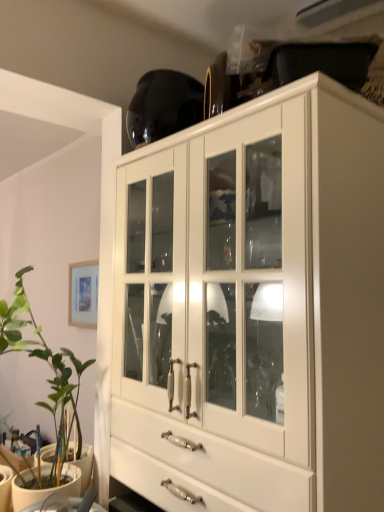
Question: Choose the correct answer: Is green leafy plant at left inside white glossy cabinet at upper center or outside it?

Choices:
 (A) outside
 (B) inside

Answer: (A)

Question: Looking at the image, does green leafy plant at left seem bigger or smaller compared to white glossy cabinet at upper center?

Choices:
 (A) small
 (B) big

Answer: (A)

Question: From the image's perspective, is green leafy plant at left above or below white glossy cabinet at upper center?

Choices:
 (A) below
 (B) above

Answer: (A)

Question: From a real-world perspective, is white glossy cabinet at upper center positioned above or below green leafy plant at left?

Choices:
 (A) below
 (B) above

Answer: (B)

Question: From the image's perspective, relative to green leafy plant at left, is white glossy cabinet at upper center above or below?

Choices:
 (A) above
 (B) below

Answer: (A)

Question: Is white glossy cabinet at upper center taller or shorter than green leafy plant at left?

Choices:
 (A) tall
 (B) short

Answer: (A)

Question: Looking at their shapes, would you say white glossy cabinet at upper center is wider or thinner than green leafy plant at left?

Choices:
 (A) thin
 (B) wide

Answer: (B)